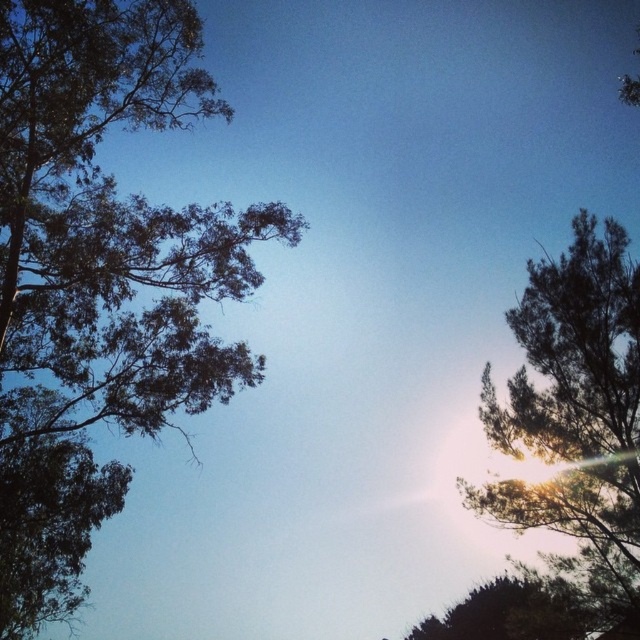
You are a photographer trying to capture the exact position of the green leafy tree at upper left in the image. According to the coordinates provided, what are the x and y values representing its position?

The green leafy tree at upper left is located at the 2D coordinates of point 0.350 on the x axis and 0.173 on the y axis.

You are an observer looking at the sky scene. You notice the green leafy tree at upper left and the dark green leafy tree at upper right. Which tree appears closer to you?

The green leafy tree at upper left appears closer because it is in front of the dark green leafy tree at upper right.